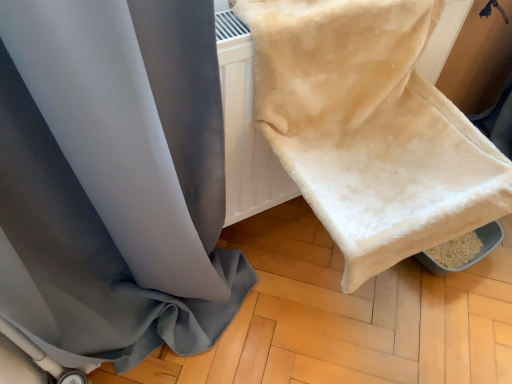
What do you see at coordinates (113, 180) in the screenshot?
I see `satin gray curtain at upper left` at bounding box center [113, 180].

The height and width of the screenshot is (384, 512). I want to click on satin gray curtain at upper left, so click(113, 180).

Image resolution: width=512 pixels, height=384 pixels. Find the location of `beige plush towel at upper right`. beige plush towel at upper right is located at coordinates (370, 128).

Measure the distance between beige plush towel at upper right and camera.

A distance of 29.75 inches exists between beige plush towel at upper right and camera.

This screenshot has width=512, height=384. What do you see at coordinates (370, 128) in the screenshot? I see `beige plush towel at upper right` at bounding box center [370, 128].

I want to click on satin gray curtain at upper left, so click(x=113, y=180).

Considering the relative positions of beige plush towel at upper right and satin gray curtain at upper left in the image provided, is beige plush towel at upper right to the left of satin gray curtain at upper left from the viewer's perspective?

In fact, beige plush towel at upper right is to the right of satin gray curtain at upper left.

Which object is further away from the camera taking this photo, beige plush towel at upper right or satin gray curtain at upper left?

beige plush towel at upper right is behind.

Which is behind, point (400, 236) or point (184, 209)?

The point (400, 236) is more distant.

From the image's perspective, which one is positioned lower, beige plush towel at upper right or satin gray curtain at upper left?

satin gray curtain at upper left appears lower in the image.

From a real-world perspective, which is physically below, beige plush towel at upper right or satin gray curtain at upper left?

satin gray curtain at upper left, from a real-world perspective.

Considering the sizes of objects beige plush towel at upper right and satin gray curtain at upper left in the image provided, who is wider, beige plush towel at upper right or satin gray curtain at upper left?

Wider between the two is beige plush towel at upper right.

Considering the sizes of beige plush towel at upper right and satin gray curtain at upper left in the image, is beige plush towel at upper right taller or shorter than satin gray curtain at upper left?

Clearly, beige plush towel at upper right is shorter compared to satin gray curtain at upper left.

Is beige plush towel at upper right bigger or smaller than satin gray curtain at upper left?

Clearly, beige plush towel at upper right is smaller in size than satin gray curtain at upper left.

Is beige plush towel at upper right inside the boundaries of satin gray curtain at upper left, or outside?

beige plush towel at upper right is not enclosed by satin gray curtain at upper left.

Are beige plush towel at upper right and satin gray curtain at upper left located far from each other?

They are positioned close to each other.

Looking at this image, is beige plush towel at upper right turned away from satin gray curtain at upper left?

No, satin gray curtain at upper left is not at the back of beige plush towel at upper right.

Measure the distance from beige plush towel at upper right to satin gray curtain at upper left.

A distance of 15.63 inches exists between beige plush towel at upper right and satin gray curtain at upper left.

Identify the location of curtain on the left of beige plush towel at upper right. The height and width of the screenshot is (384, 512). (113, 180).

Is satin gray curtain at upper left at the right side of beige plush towel at upper right?

Incorrect, satin gray curtain at upper left is not on the right side of beige plush towel at upper right.

Considering the relative positions of satin gray curtain at upper left and beige plush towel at upper right in the image provided, is satin gray curtain at upper left behind beige plush towel at upper right?

No.

Which is nearer, [46,270] or [368,11]?

Point [46,270] is positioned farther from the camera compared to point [368,11].

From the image's perspective, is satin gray curtain at upper left over beige plush towel at upper right?

No, from the image's perspective, satin gray curtain at upper left is not on top of beige plush towel at upper right.

From a real-world perspective, is satin gray curtain at upper left above or below beige plush towel at upper right?

Clearly, from a real-world perspective, satin gray curtain at upper left is below beige plush towel at upper right.

Which of these two, satin gray curtain at upper left or beige plush towel at upper right, is thinner?

satin gray curtain at upper left is thinner.

From the picture: Does satin gray curtain at upper left have a greater height compared to beige plush towel at upper right?

Yes.

In the scene shown: Which of these two, satin gray curtain at upper left or beige plush towel at upper right, is bigger?

satin gray curtain at upper left is bigger.

Is satin gray curtain at upper left positioned beyond the bounds of beige plush towel at upper right?

Yes, satin gray curtain at upper left is located beyond the bounds of beige plush towel at upper right.

Is satin gray curtain at upper left far from beige plush towel at upper right?

That's not correct — satin gray curtain at upper left is a little close to beige plush towel at upper right.

Could you tell me if satin gray curtain at upper left is facing beige plush towel at upper right?

No, satin gray curtain at upper left is not aimed at beige plush towel at upper right.

Consider the image. What's the angular difference between satin gray curtain at upper left and beige plush towel at upper right's facing directions?

The angular difference between satin gray curtain at upper left and beige plush towel at upper right is 0.645 degrees.

I want to click on curtain on the left of beige plush towel at upper right, so click(113, 180).

Image resolution: width=512 pixels, height=384 pixels. Find the location of `towel on the right of satin gray curtain at upper left`. towel on the right of satin gray curtain at upper left is located at coordinates (370, 128).

The height and width of the screenshot is (384, 512). In order to click on towel above the satin gray curtain at upper left (from a real-world perspective) in this screenshot , I will do coord(370,128).